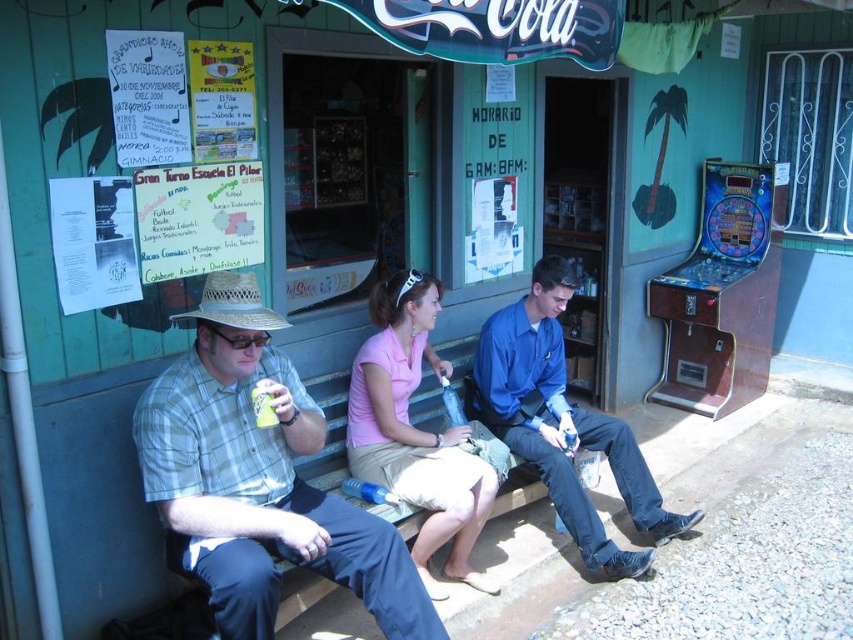
Between point (491, 385) and point (672, 314), which one is positioned behind?

Positioned behind is point (672, 314).

Find the location of a particular element. This screenshot has width=853, height=640. blue cotton shirt at center is located at coordinates (563, 422).

Which is more to the right, plaid fabric shirt at left or pink fabric shirt at center?

pink fabric shirt at center

Between plaid fabric shirt at left and pink fabric shirt at center, which one appears on the left side from the viewer's perspective?

plaid fabric shirt at left

Where is `plaid fabric shirt at left`? This screenshot has width=853, height=640. plaid fabric shirt at left is located at coordinates (258, 480).

Does blue cotton shirt at center appear under green matte can at center?

Yes.

Who is positioned more to the left, blue cotton shirt at center or green matte can at center?

green matte can at center

You are a GUI agent. You are given a task and a screenshot of the screen. Output one action in this format:
    pyautogui.click(x=<x>, y=<y>)
    Task: Click on the blue cotton shirt at center
    Image resolution: width=853 pixels, height=640 pixels.
    Given the screenshot: What is the action you would take?
    pyautogui.click(x=563, y=422)